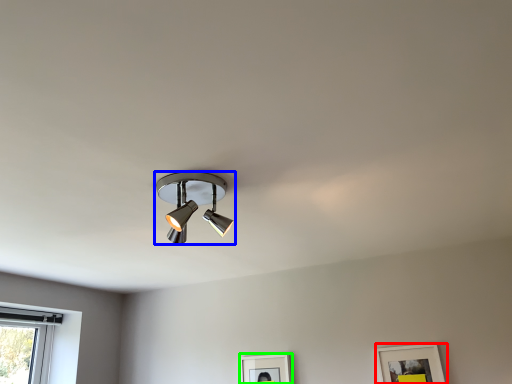
Question: Which object is positioned closest to picture frame (highlighted by a red box)? Select from lamp (highlighted by a blue box) and picture frame (highlighted by a green box).

Choices:
 (A) lamp
 (B) picture frame

Answer: (B)